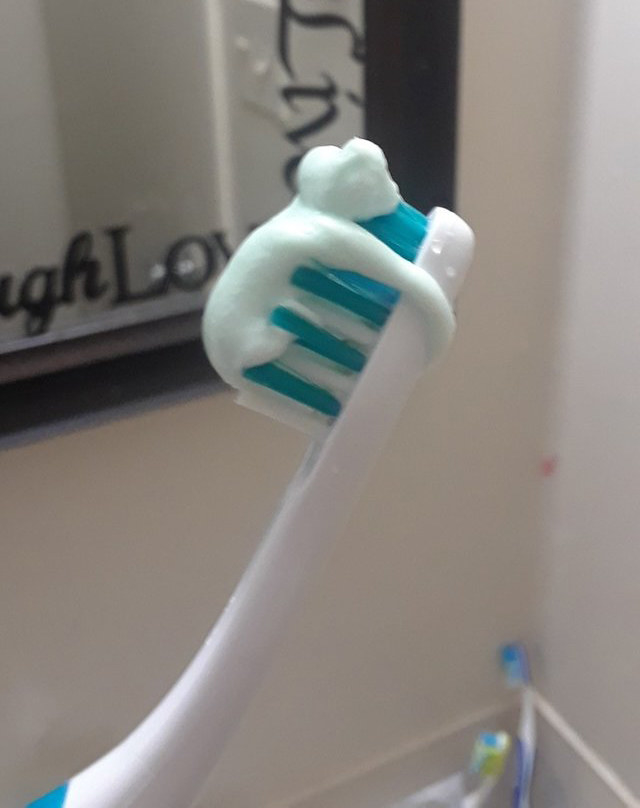
Locate an element on the screen. paint is located at coordinates (125, 574).